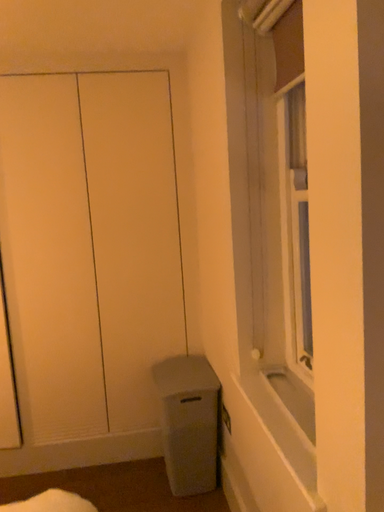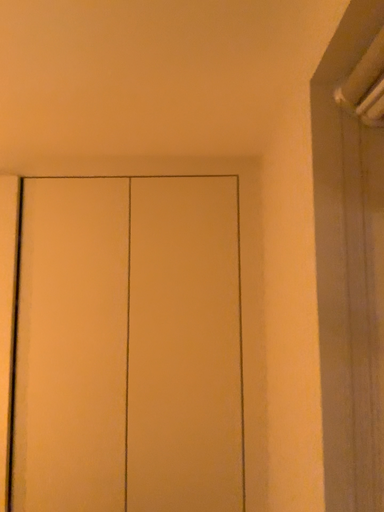
Question: Which way did the camera rotate in the video?

Choices:
 (A) rotated left
 (B) rotated right

Answer: (A)